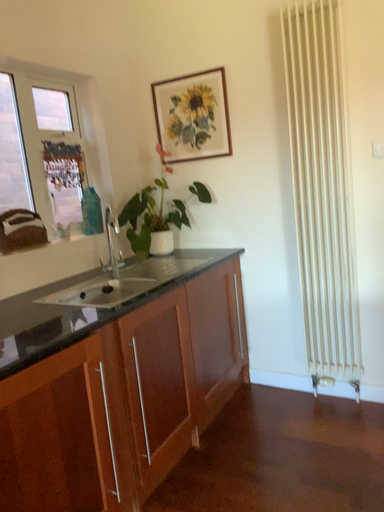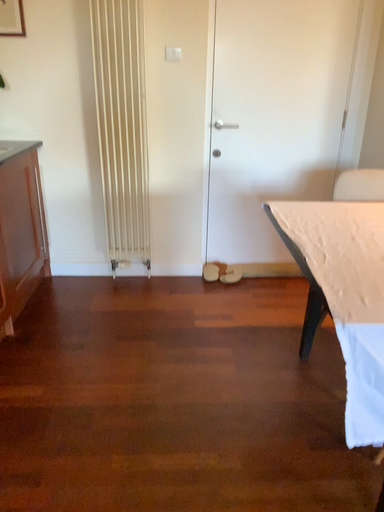
Question: How did the camera likely rotate when shooting the video?

Choices:
 (A) rotated left
 (B) rotated right

Answer: (B)